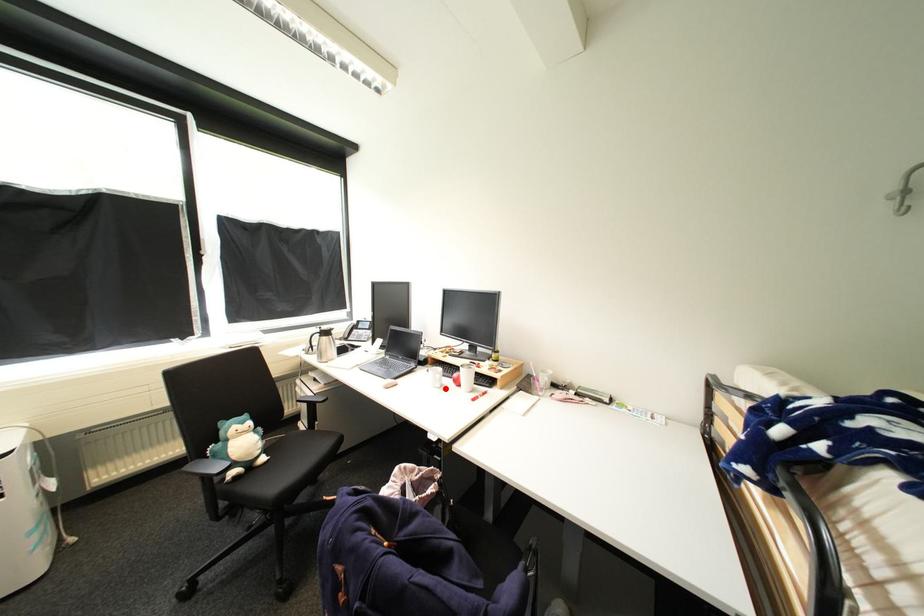
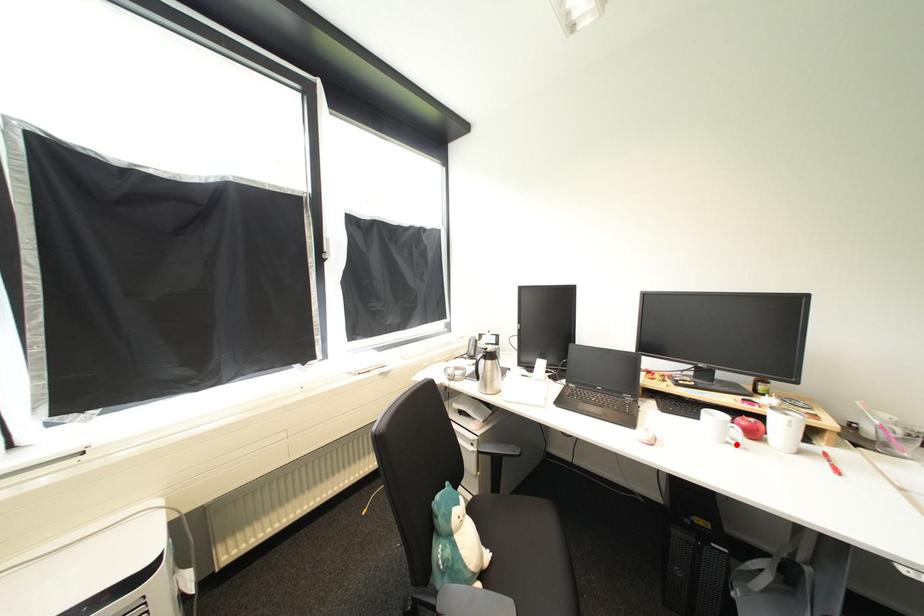
I am providing you with two images of the same scene from different viewpoints. A red point is marked on the first image and another point is marked on the second image. Is the marked point in image1 the same physical position as the marked point in image2?

Yes